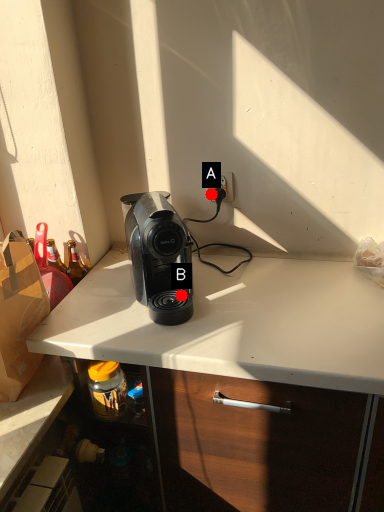
Question: Two points are circled on the image, labeled by A and B beside each circle. Which point is farther to the camera?

Choices:
 (A) A is further
 (B) B is further

Answer: (A)